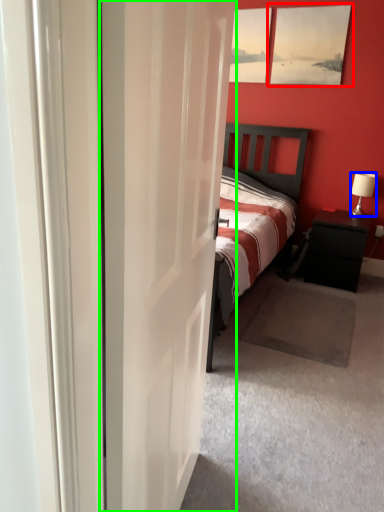
Question: Estimate the real-world distances between objects in this image. Which object is farther from picture frame (highlighted by a red box), lamp (highlighted by a blue box) or door (highlighted by a green box)?

Choices:
 (A) lamp
 (B) door

Answer: (B)